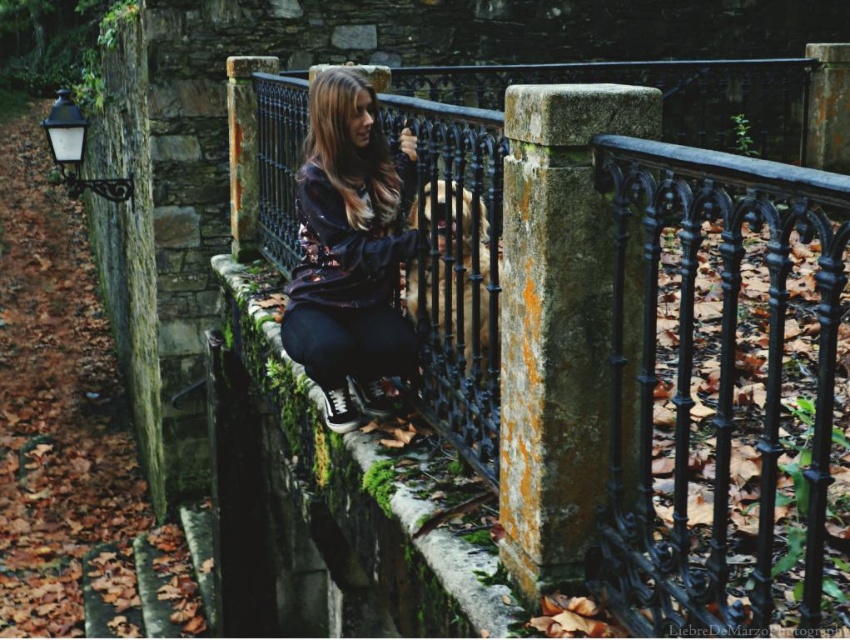
Which is above, black wrought iron fence at center or mossy stone ledge at center?

black wrought iron fence at center is above.

Is black wrought iron fence at center wider than mossy stone ledge at center?

Indeed, black wrought iron fence at center has a greater width compared to mossy stone ledge at center.

Does point (434, 390) lie behind point (224, 269)?

No, (434, 390) is closer to viewer.

You are a GUI agent. You are given a task and a screenshot of the screen. Output one action in this format:
    pyautogui.click(x=<x>, y=<y>)
    Task: Click on the black wrought iron fence at center
    The height and width of the screenshot is (640, 850).
    Given the screenshot: What is the action you would take?
    pyautogui.click(x=655, y=360)

Does black wrought iron railing at center right have a smaller size compared to mossy stone ledge at center?

No, black wrought iron railing at center right is not smaller than mossy stone ledge at center.

Which is below, black wrought iron railing at center right or mossy stone ledge at center?

mossy stone ledge at center is below.

This screenshot has height=640, width=850. Identify the location of black wrought iron railing at center right. (718, 385).

Is black wrought iron fence at center shorter than shiny black hoodie at center?

No.

Does black wrought iron fence at center appear over shiny black hoodie at center?

No.

Is point (672, 547) positioned before point (323, 211)?

That is True.

Where is `black wrought iron fence at center`? The image size is (850, 640). black wrought iron fence at center is located at coordinates (655, 360).